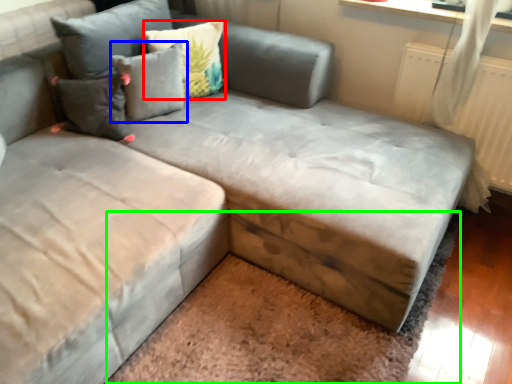
Question: Estimate the real-world distances between objects in this image. Which object is closer to pillow (highlighted by a red box), pillow (highlighted by a blue box) or mat (highlighted by a green box)?

Choices:
 (A) pillow
 (B) mat

Answer: (A)